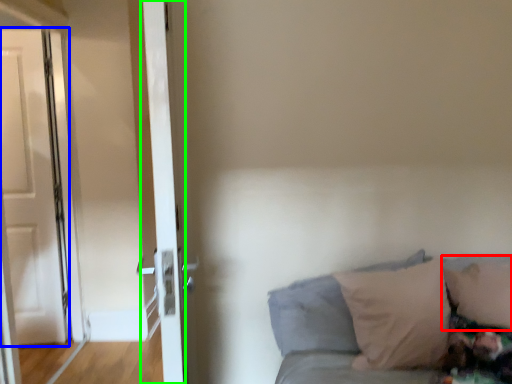
Question: Considering the real-world distances, which object is farthest from pillow (highlighted by a red box)? door (highlighted by a blue box) or door (highlighted by a green box)?

Choices:
 (A) door
 (B) door

Answer: (A)